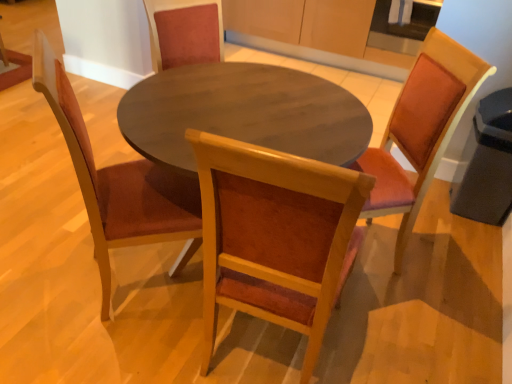
Identify the location of vacant space to the right of wooden chair at right, marked as the first chair in a right-to-left arrangement. (x=442, y=271).